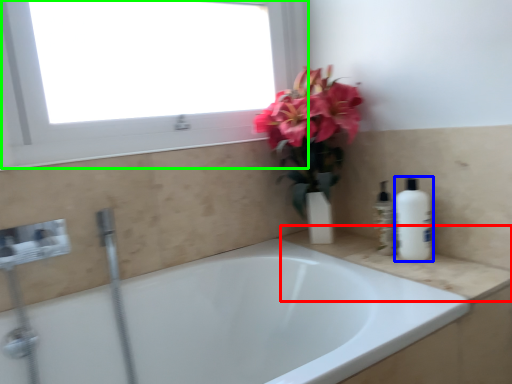
Question: Considering the real-world distances, which object is farthest from counter top (highlighted by a red box)? cleaning product (highlighted by a blue box) or window (highlighted by a green box)?

Choices:
 (A) cleaning product
 (B) window

Answer: (B)